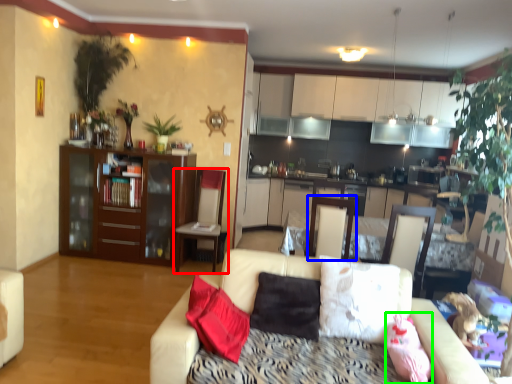
Question: Which object is positioned closest to chair (highlighted by a red box)? Select from swivel chair (highlighted by a blue box) and pillow (highlighted by a green box).

Choices:
 (A) swivel chair
 (B) pillow

Answer: (A)